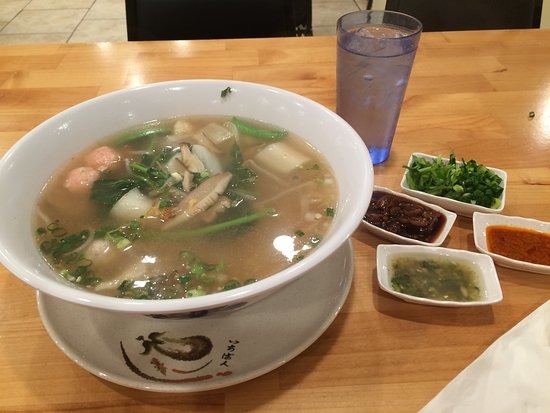
Identify the location of sauce containers. The height and width of the screenshot is (413, 550). (485, 230), (469, 203), (436, 225), (422, 257).